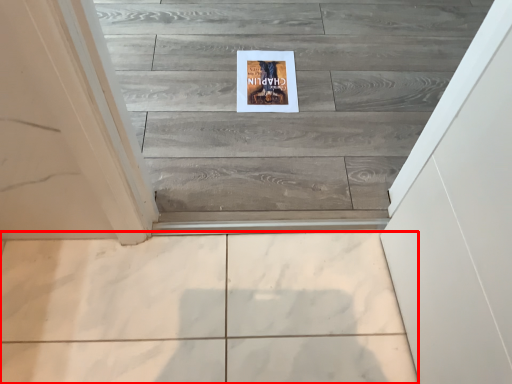
Question: From the image's perspective, what is the correct spatial positioning of ceramic tile (annotated by the red box) in reference to postcard?

Choices:
 (A) above
 (B) below

Answer: (B)